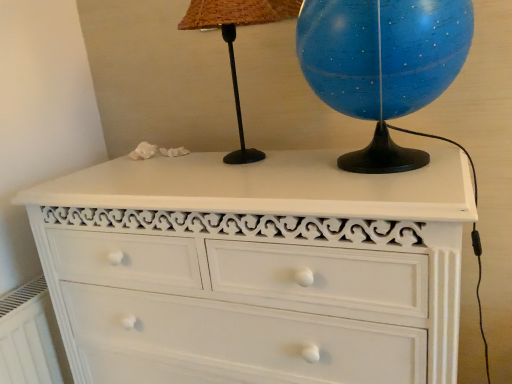
Question: Does white painted radiator at lower left have a lesser height compared to white painted wood chest of drawers at center?

Choices:
 (A) yes
 (B) no

Answer: (A)

Question: Is white painted radiator at lower left outside white painted wood chest of drawers at center?

Choices:
 (A) no
 (B) yes

Answer: (B)

Question: Is white painted radiator at lower left thinner than white painted wood chest of drawers at center?

Choices:
 (A) yes
 (B) no

Answer: (A)

Question: Considering the relative sizes of white painted radiator at lower left and white painted wood chest of drawers at center in the image provided, is white painted radiator at lower left smaller than white painted wood chest of drawers at center?

Choices:
 (A) no
 (B) yes

Answer: (B)

Question: From the image's perspective, is white painted radiator at lower left above white painted wood chest of drawers at center?

Choices:
 (A) yes
 (B) no

Answer: (B)

Question: From the image's perspective, is blue glossy globe at upper right above or below black matte table lamp at upper center?

Choices:
 (A) above
 (B) below

Answer: (B)

Question: From a real-world perspective, relative to black matte table lamp at upper center, is blue glossy globe at upper right vertically above or below?

Choices:
 (A) above
 (B) below

Answer: (B)

Question: Considering the positions of point (321, 59) and point (232, 87), is point (321, 59) closer or farther from the camera than point (232, 87)?

Choices:
 (A) closer
 (B) farther

Answer: (A)

Question: Is blue glossy globe at upper right to the left or to the right of black matte table lamp at upper center in the image?

Choices:
 (A) left
 (B) right

Answer: (B)

Question: Looking at the image, does blue glossy globe at upper right seem bigger or smaller compared to white painted radiator at lower left?

Choices:
 (A) big
 (B) small

Answer: (A)

Question: In the image, is blue glossy globe at upper right positioned in front of or behind white painted radiator at lower left?

Choices:
 (A) front
 (B) behind

Answer: (A)

Question: Does point (408, 16) appear closer or farther from the camera than point (44, 279)?

Choices:
 (A) farther
 (B) closer

Answer: (B)

Question: From the image's perspective, is blue glossy globe at upper right located above or below white painted radiator at lower left?

Choices:
 (A) above
 (B) below

Answer: (A)

Question: From their relative heights in the image, would you say white painted radiator at lower left is taller or shorter than black matte table lamp at upper center?

Choices:
 (A) tall
 (B) short

Answer: (B)

Question: Is white painted radiator at lower left spatially inside black matte table lamp at upper center, or outside of it?

Choices:
 (A) outside
 (B) inside

Answer: (A)